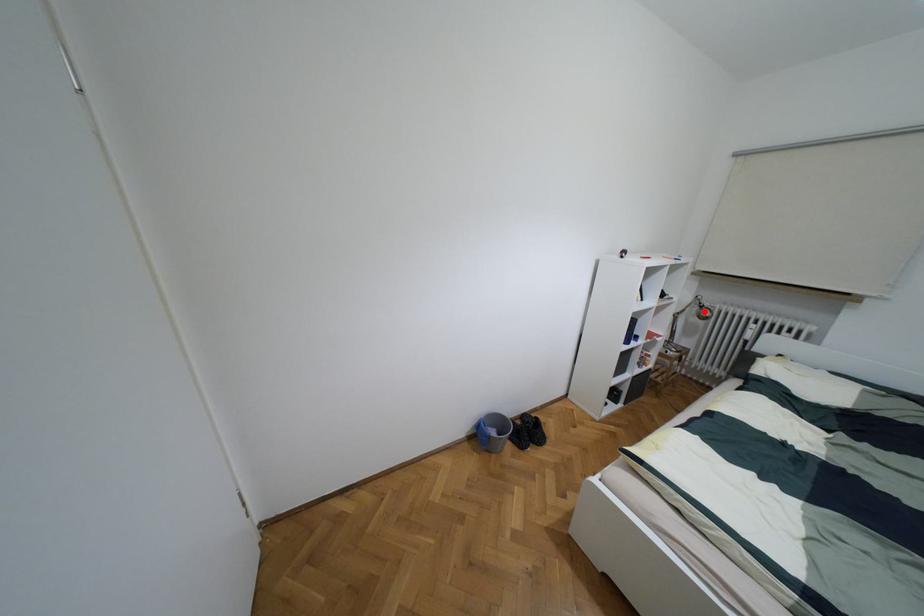
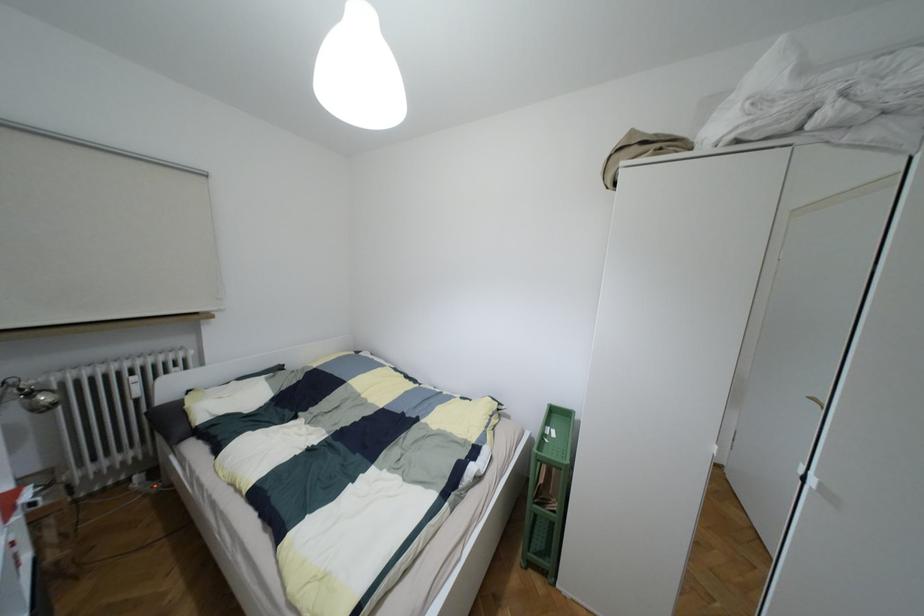
Find the pixel in the second image that matches the highlighted location in the first image.

(43, 397)